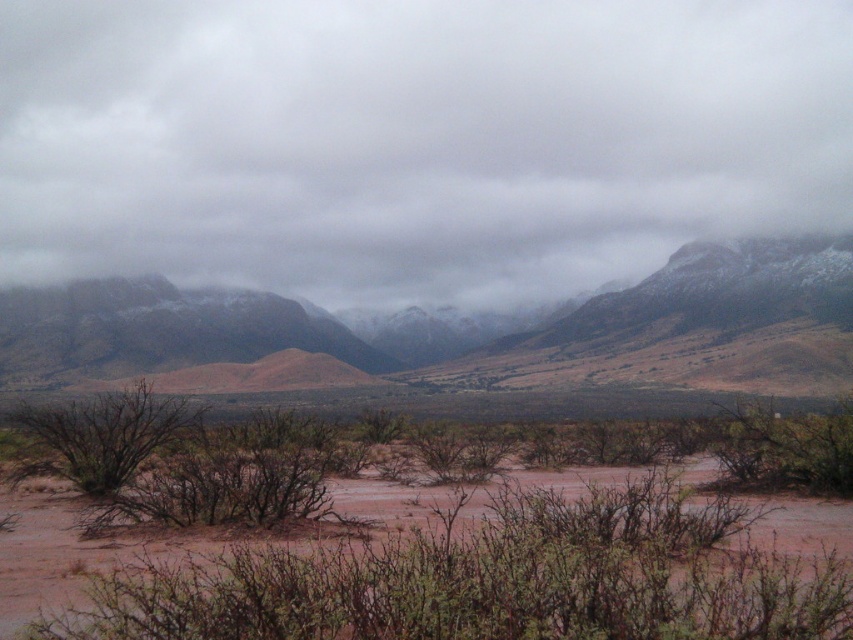
Question: Can you confirm if brown dry bush at lower left is smaller than green leafy bush at center?

Choices:
 (A) yes
 (B) no

Answer: (A)

Question: Is brown sandy soil at center wider than green leafy bush at center?

Choices:
 (A) yes
 (B) no

Answer: (A)

Question: Which point is farther to the camera?

Choices:
 (A) pyautogui.click(x=579, y=99)
 (B) pyautogui.click(x=811, y=442)
 (C) pyautogui.click(x=82, y=413)
 (D) pyautogui.click(x=219, y=429)

Answer: (A)

Question: Which of the following is the closest to the observer?

Choices:
 (A) (83, 300)
 (B) (70, 630)
 (C) (86, 449)
 (D) (753, 483)

Answer: (B)

Question: Based on their relative distances, which object is nearer to the brown dry bush at lower left?

Choices:
 (A) green leafy bush at center
 (B) snow-covered mountain range at upper center
 (C) brown dry bush at center
 (D) brown sandy soil at center

Answer: (C)

Question: Where is snow-covered mountain range at upper center located in relation to green leafy bush at center in the image?

Choices:
 (A) below
 (B) above

Answer: (B)